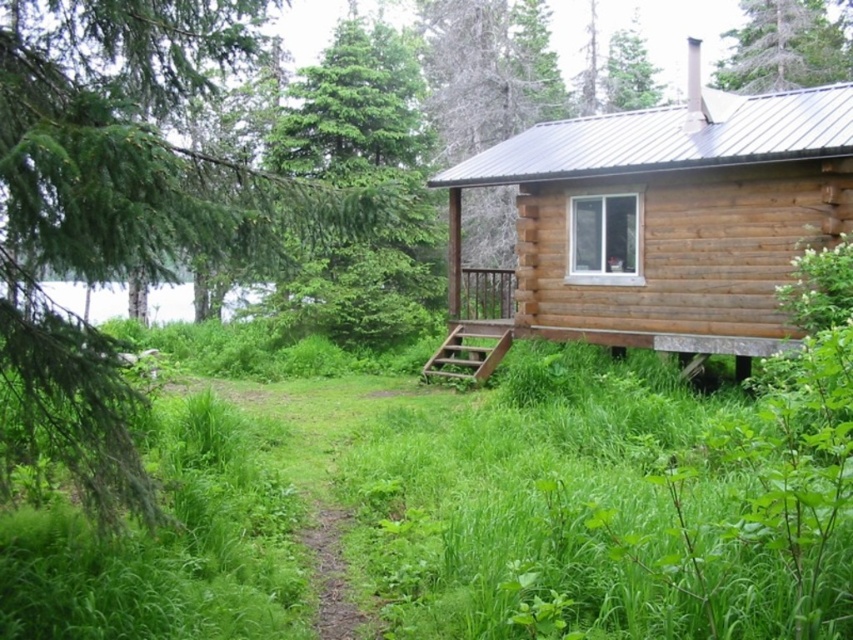
Question: Does green grass at center appear on the right side of green textured tree at upper center?

Choices:
 (A) yes
 (B) no

Answer: (B)

Question: Which point is closer to the camera?

Choices:
 (A) (553, 422)
 (B) (343, 104)
 (C) (828, 68)

Answer: (A)

Question: Which of the following is the closest to the observer?

Choices:
 (A) (x=421, y=200)
 (B) (x=807, y=51)
 (C) (x=235, y=177)
 (D) (x=517, y=211)

Answer: (C)

Question: Does green grass at center appear over green leafy tree at upper left?

Choices:
 (A) no
 (B) yes

Answer: (A)

Question: Does brown wooden cabin at center appear under green leafy tree at upper left?

Choices:
 (A) yes
 (B) no

Answer: (A)

Question: Among these points, which one is farthest from the camera?

Choices:
 (A) (296, 84)
 (B) (737, 51)
 (C) (685, 198)
 (D) (648, 451)

Answer: (B)